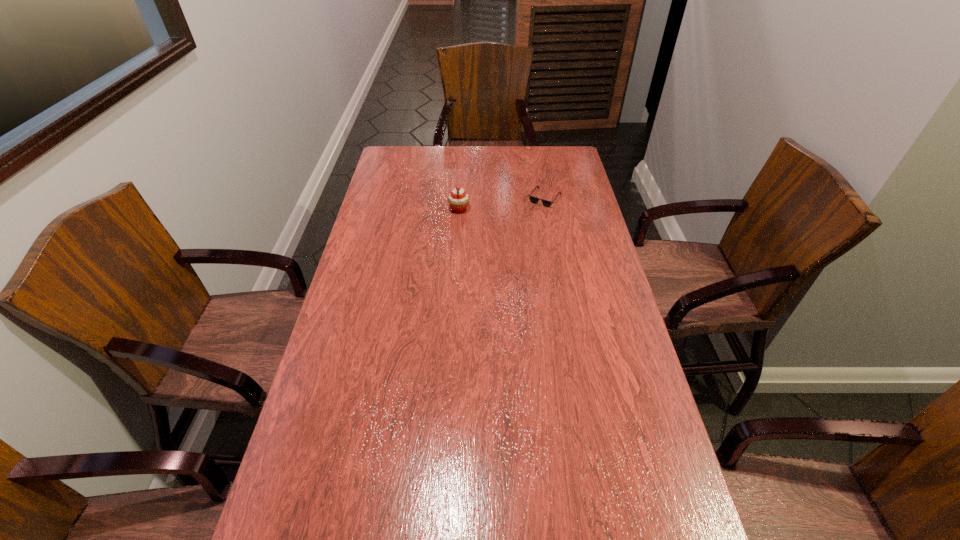
In the image, there is a desktop. Identify the location of vacant area at the far left corner. (402, 168).

Image resolution: width=960 pixels, height=540 pixels. Find the location of `vacant area that lies between the left object and the right object`. vacant area that lies between the left object and the right object is located at coordinates (502, 204).

You are a GUI agent. You are given a task and a screenshot of the screen. Output one action in this format:
    pyautogui.click(x=<x>, y=<y>)
    Task: Click on the unoccupied position between the taller object and the right object
    
    Given the screenshot: What is the action you would take?
    pyautogui.click(x=502, y=204)